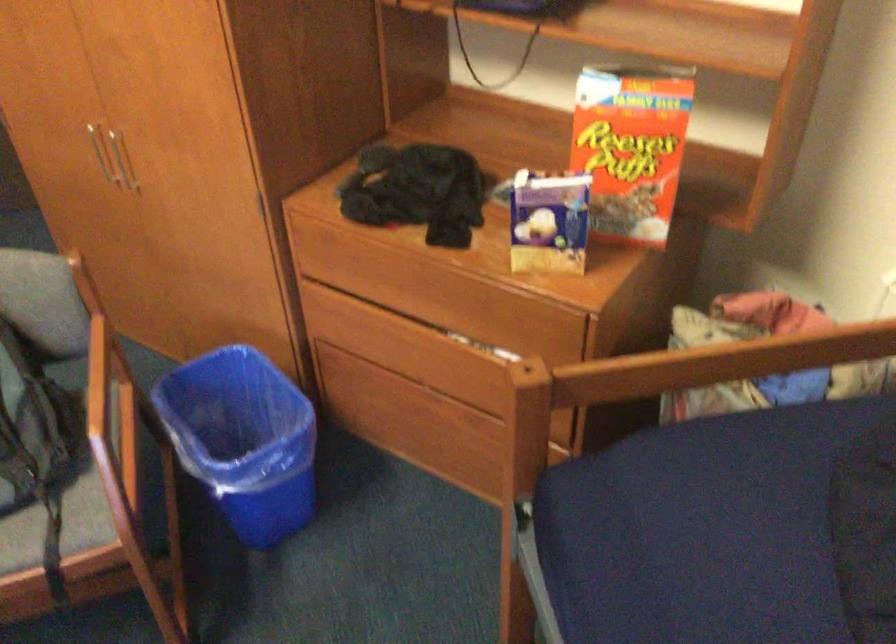
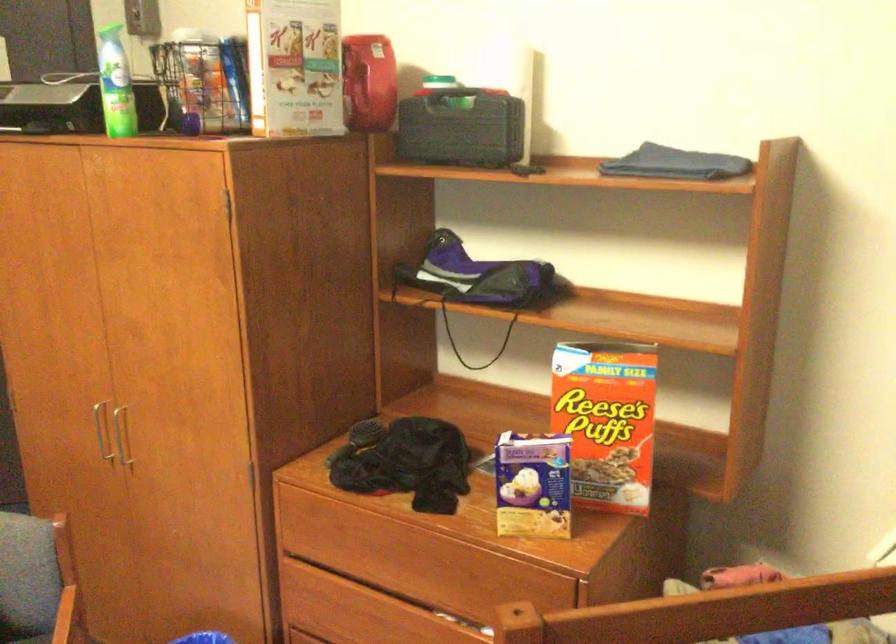
Where in the second image is the point corresponding to pixel 395 322 from the first image?

(377, 598)